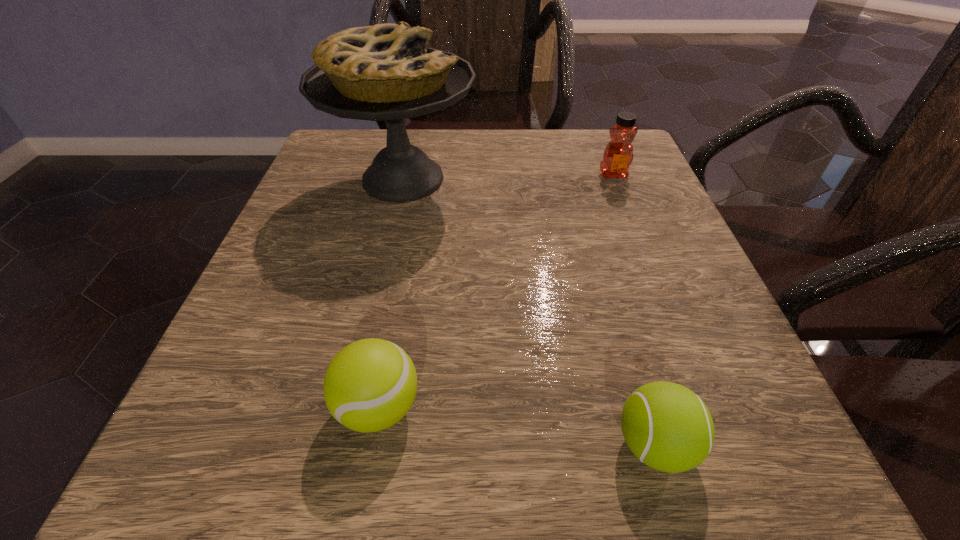
I want to click on free space at the far right corner, so click(x=594, y=161).

This screenshot has height=540, width=960. What are the coordinates of `free area in between the right tennis ball and the left tennis ball` in the screenshot? It's located at (516, 426).

This screenshot has height=540, width=960. Find the location of `vacant area that lies between the left tennis ball and the tallest object`. vacant area that lies between the left tennis ball and the tallest object is located at coordinates (391, 293).

At what (x,y) coordinates should I click in order to perform the action: click on vacant area that lies between the left tennis ball and the tallest object. Please return your answer as a coordinate pair (x, y). The height and width of the screenshot is (540, 960). Looking at the image, I should click on (391, 293).

The image size is (960, 540). What are the coordinates of `free area in between the right tennis ball and the left tennis ball` in the screenshot? It's located at (516, 426).

At what (x,y) coordinates should I click in order to perform the action: click on free spot between the honey and the left tennis ball. Please return your answer as a coordinate pair (x, y). The image size is (960, 540). Looking at the image, I should click on (496, 291).

Where is `vacant space in between the honey and the tallest object`? Image resolution: width=960 pixels, height=540 pixels. vacant space in between the honey and the tallest object is located at coordinates (508, 177).

This screenshot has width=960, height=540. I want to click on free spot between the right tennis ball and the tallest object, so click(529, 312).

At what (x,y) coordinates should I click in order to perform the action: click on vacant area that lies between the right tennis ball and the left tennis ball. Please return your answer as a coordinate pair (x, y). Image resolution: width=960 pixels, height=540 pixels. Looking at the image, I should click on (516, 426).

Find the location of `free space between the right tennis ball and the pie`. free space between the right tennis ball and the pie is located at coordinates (529, 312).